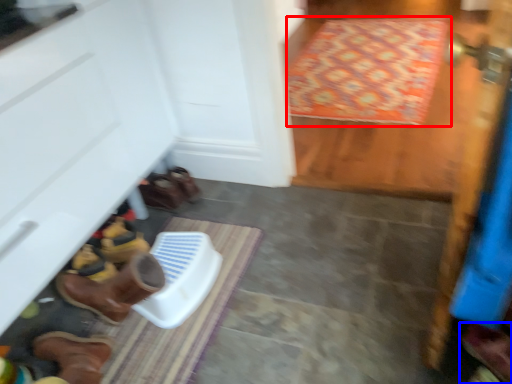
Question: Which object appears closest to the camera in this image, doormat (highlighted by a red box) or footwear (highlighted by a blue box)?

Choices:
 (A) doormat
 (B) footwear

Answer: (B)